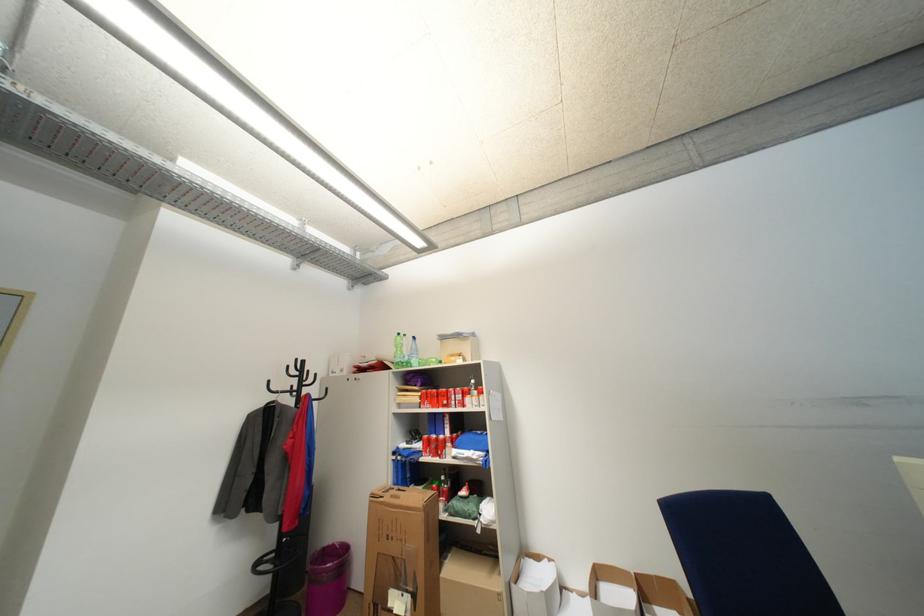
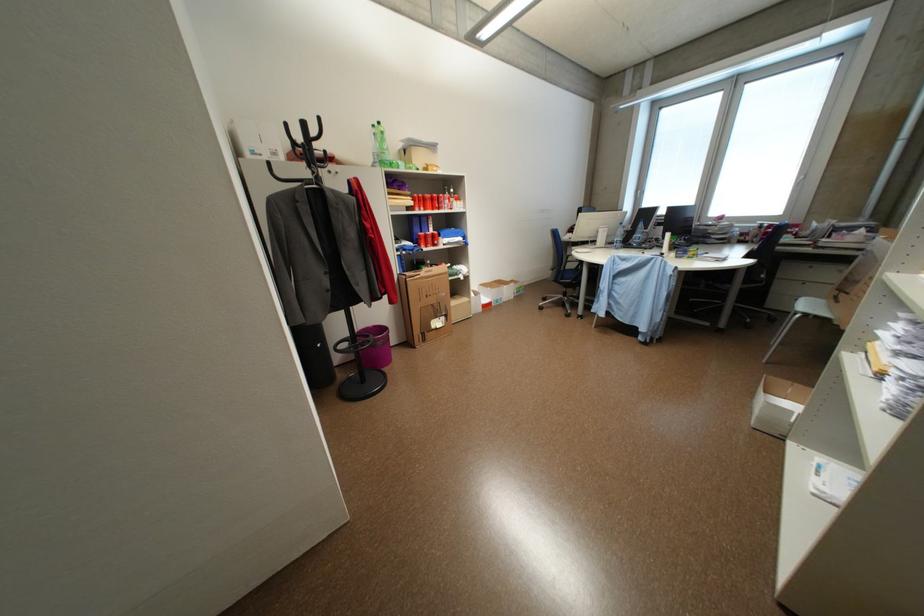
Find the pixel in the second image that matches pixel 390 504 in the first image.

(428, 280)